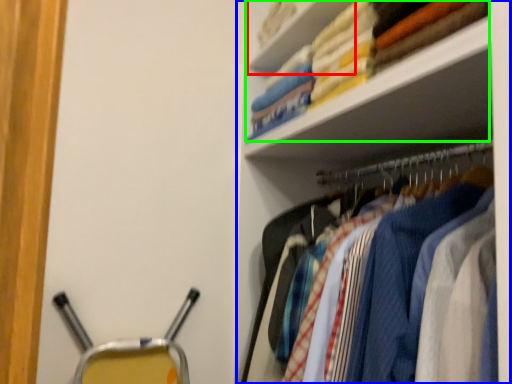
Question: Considering the real-world distances, which object is farthest from cabinet (highlighted by a red box)? shelf (highlighted by a blue box) or laundry (highlighted by a green box)?

Choices:
 (A) shelf
 (B) laundry

Answer: (A)